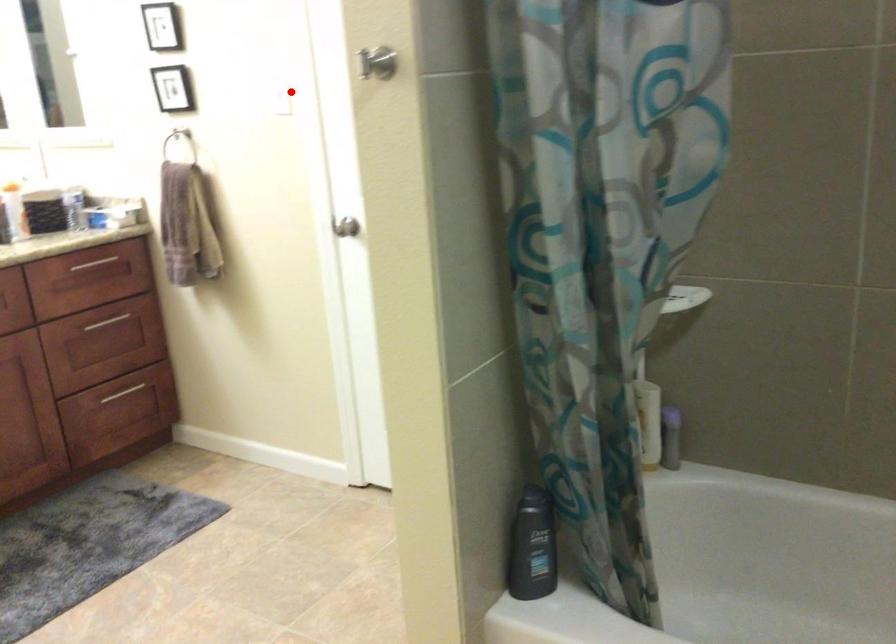
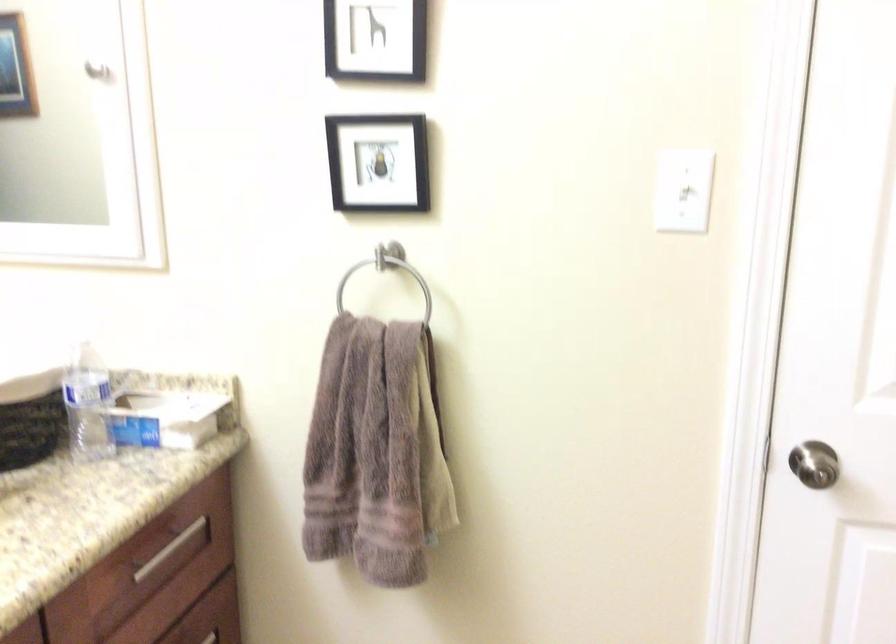
Question: I am providing you with two images of the same scene from different viewpoints. Image1 has a red point marked. In image2, the corresponding 3D location appears at what relative position? Reply with the corresponding letter.

Choices:
 (A) Closer
 (B) Farther

Answer: (A)